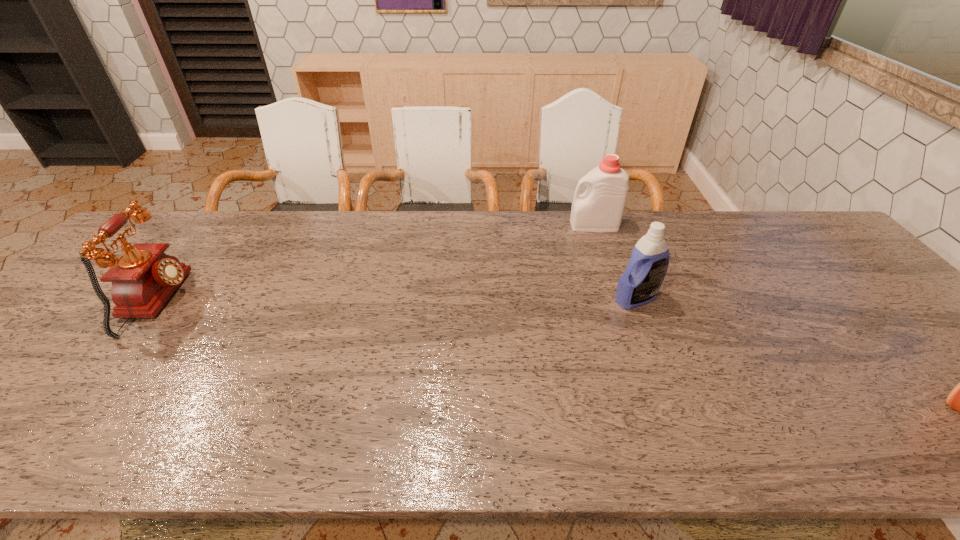
The image size is (960, 540). In the image, there is a desktop. What are the coordinates of `vacant region at the near edge` in the screenshot? It's located at (163, 435).

This screenshot has height=540, width=960. What are the coordinates of `free space at the left edge` in the screenshot? It's located at (91, 309).

The height and width of the screenshot is (540, 960). Find the location of `blank space at the right edge of the desktop`. blank space at the right edge of the desktop is located at coordinates (924, 357).

Identify the location of vacant area that lies between the farthest object and the leftmost object. (376, 264).

The width and height of the screenshot is (960, 540). In order to click on vacant space that is in between the second nearest detergent and the telephone in this screenshot , I will do `click(396, 300)`.

I want to click on free space between the telephone and the farthest object, so click(x=376, y=264).

Identify the location of vacant space that is in between the farthest object and the leftmost object. The width and height of the screenshot is (960, 540). (376, 264).

This screenshot has width=960, height=540. I want to click on vacant space that's between the leftmost object and the farthest detergent, so click(x=376, y=264).

This screenshot has width=960, height=540. I want to click on free point between the farthest detergent and the second nearest detergent, so click(x=615, y=262).

Identify the location of vacant space that's between the farthest detergent and the second farthest detergent. (615, 262).